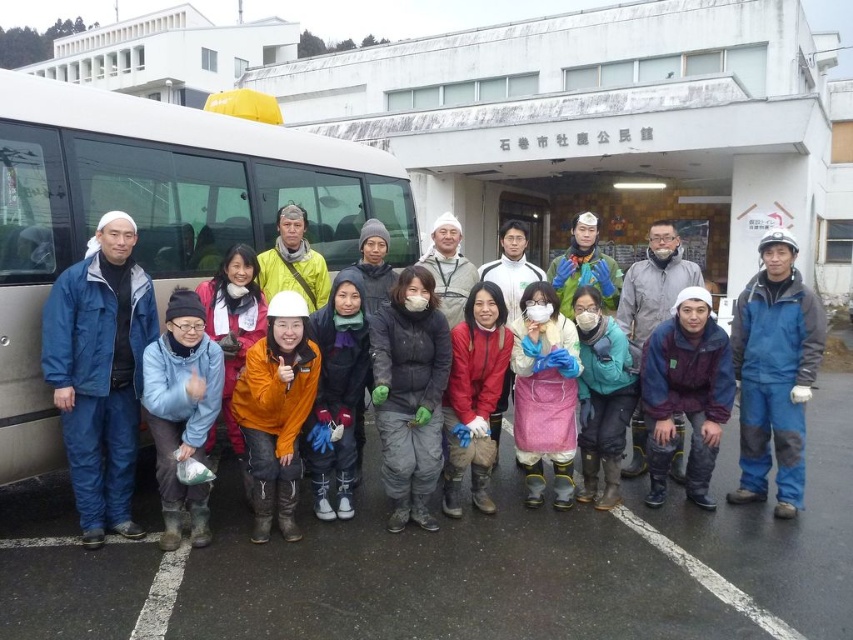
Question: Which of the following is the closest to the observer?

Choices:
 (A) teal fabric jacket at center
 (B) white matte bus at left
 (C) blue waterproof suit at left
 (D) orange softshell jacket at center

Answer: (B)

Question: Is teal fabric jacket at center thinner than orange fabric jacket at center?

Choices:
 (A) yes
 (B) no

Answer: (A)

Question: Which of the following is the farthest from the observer?

Choices:
 (A) (288, 280)
 (B) (575, 260)
 (C) (612, 356)
 (D) (178, 364)

Answer: (B)

Question: Does pink fabric at center appear over orange fabric jacket at center?

Choices:
 (A) no
 (B) yes

Answer: (A)

Question: Is pink fabric at center further to the viewer compared to blue-green fabric jacket at center?

Choices:
 (A) yes
 (B) no

Answer: (B)

Question: Which of the following is the closest to the observer?

Choices:
 (A) black matte jacket at center
 (B) white matte bus at left
 (C) blue fabric jacket at center
 (D) pink fabric at center

Answer: (B)